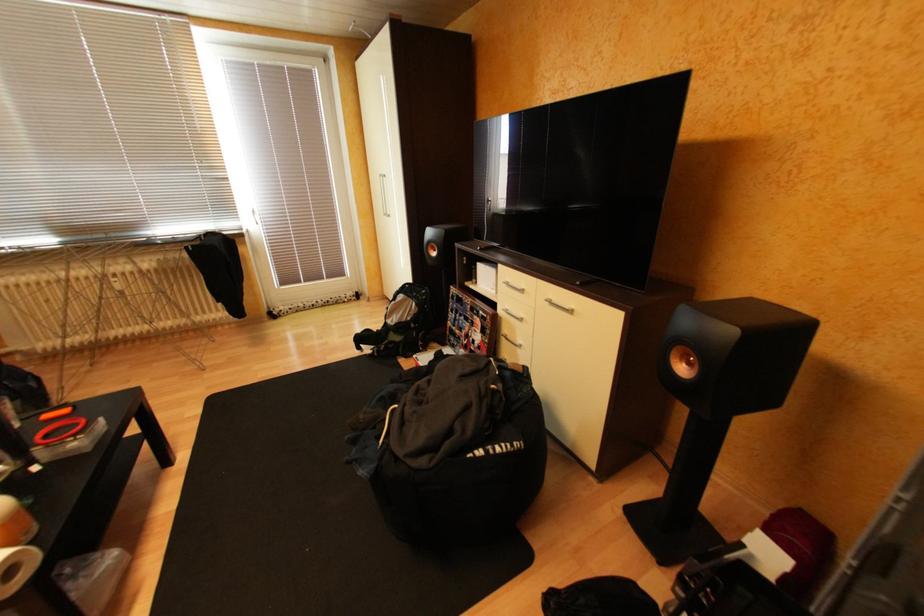
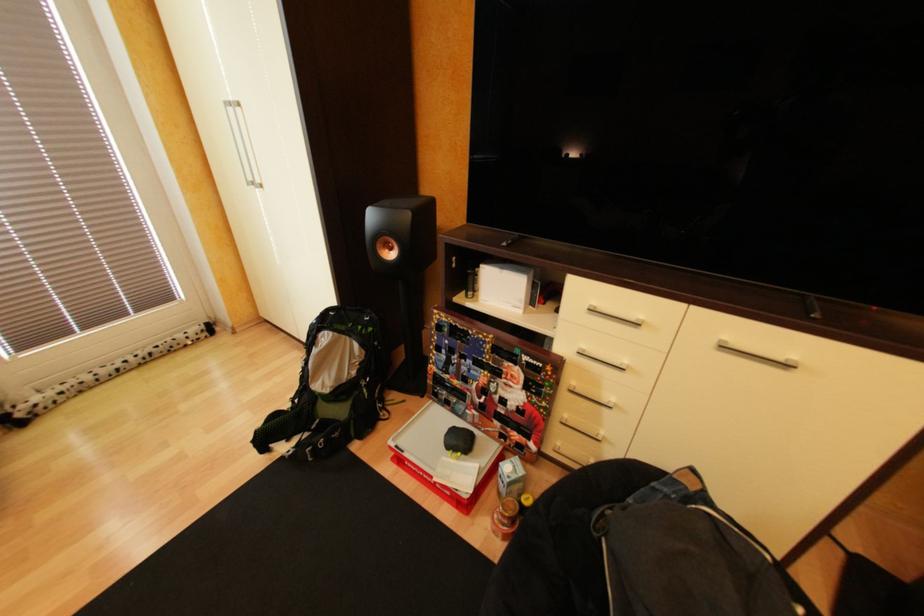
The images are taken continuously from a first-person perspective. In which direction are you moving?

The cameraman walked toward left, forward.